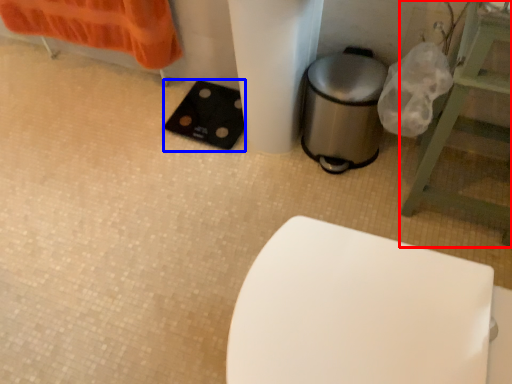
Question: Which object is further to the camera taking this photo, furniture (highlighted by a red box) or pad (highlighted by a blue box)?

Choices:
 (A) furniture
 (B) pad

Answer: (B)